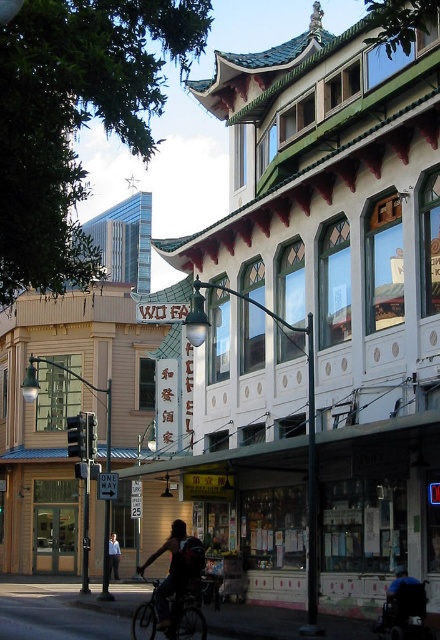
Question: Among these points, which one is farthest from the camera?

Choices:
 (A) (154, 612)
 (B) (112, 548)

Answer: (B)

Question: Which point is closer to the camera?

Choices:
 (A) dark blue shirt at center
 (B) shiny metallic bicycle at center

Answer: (B)

Question: Does shiny metallic bicycle at center appear on the left side of dark blue shirt at center?

Choices:
 (A) no
 (B) yes

Answer: (A)

Question: Is shiny metallic bicycle at center positioned before dark blue shirt at center?

Choices:
 (A) no
 (B) yes

Answer: (B)

Question: Is shiny metallic bicycle at center wider than dark blue shirt at center?

Choices:
 (A) no
 (B) yes

Answer: (B)